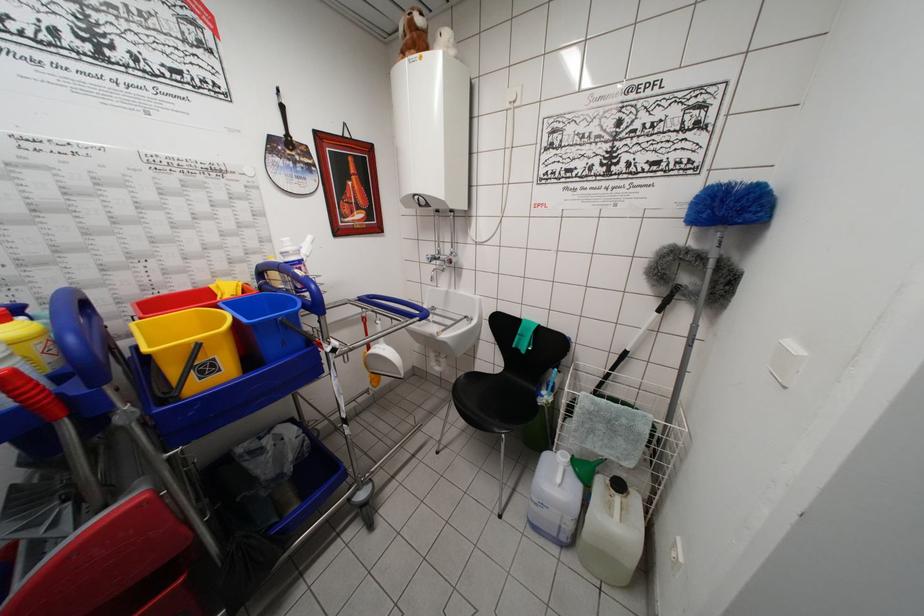
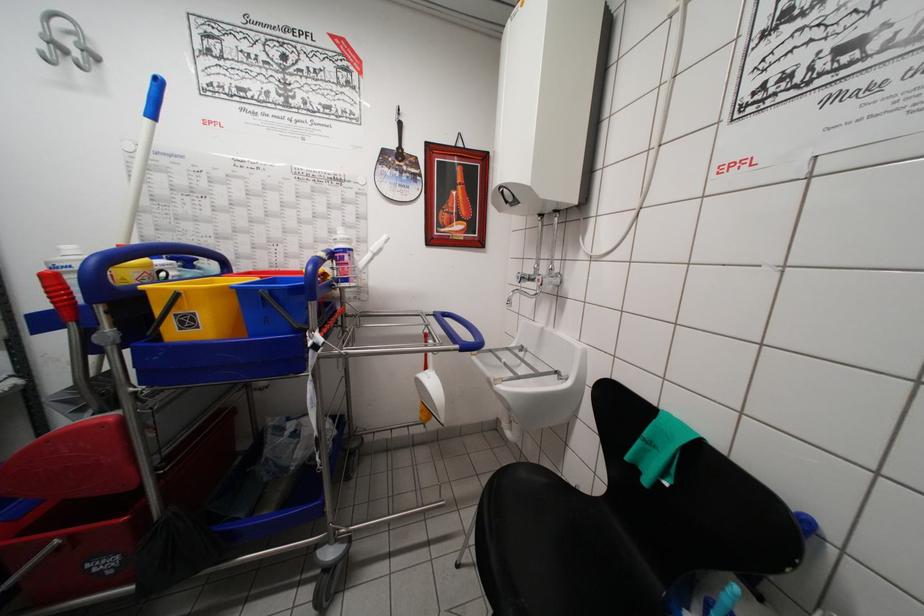
Where in the second image is the point corresponding to pixel 420 323 from the first image?

(460, 351)